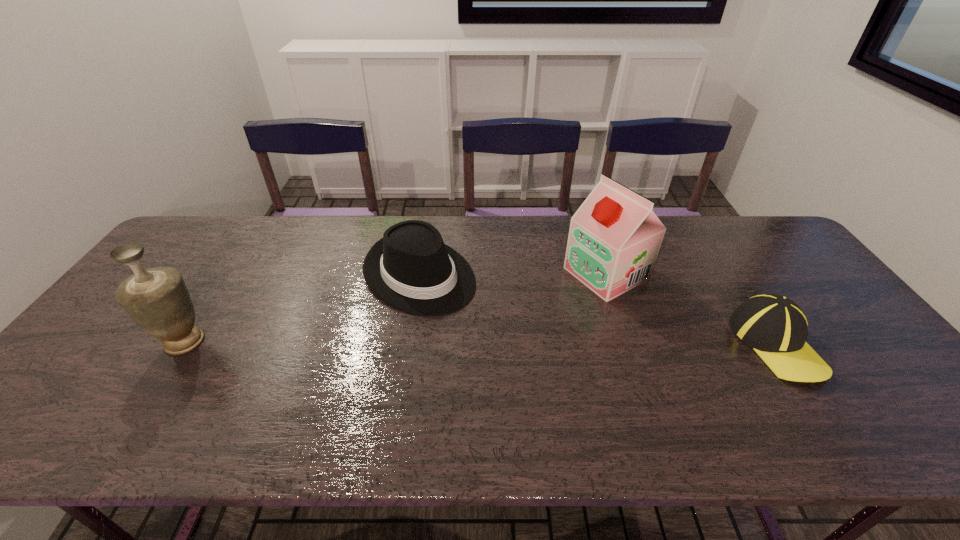
Locate an element on the screen. The image size is (960, 540). vacant space positioned 0.320m with the cap open on the soya milk is located at coordinates (484, 334).

Identify the location of vacant space situated on the front-facing side of the second shortest object. (481, 323).

Identify the location of vacant space located on the front-facing side of the second shortest object. (471, 316).

In order to click on free space located on the front-facing side of the second shortest object in this screenshot , I will do `click(543, 373)`.

I want to click on soya milk at the far edge, so click(x=614, y=239).

Where is `fedora at the far edge`? This screenshot has width=960, height=540. fedora at the far edge is located at coordinates (411, 269).

The width and height of the screenshot is (960, 540). Find the location of `object positioned at the near edge`. object positioned at the near edge is located at coordinates (774, 326).

Where is `object located in the right edge section of the desktop`? The width and height of the screenshot is (960, 540). object located in the right edge section of the desktop is located at coordinates (774, 326).

The width and height of the screenshot is (960, 540). In order to click on object that is positioned at the near right corner in this screenshot , I will do `click(774, 326)`.

Identify the location of vacant area at the far edge of the desktop. The image size is (960, 540). (514, 229).